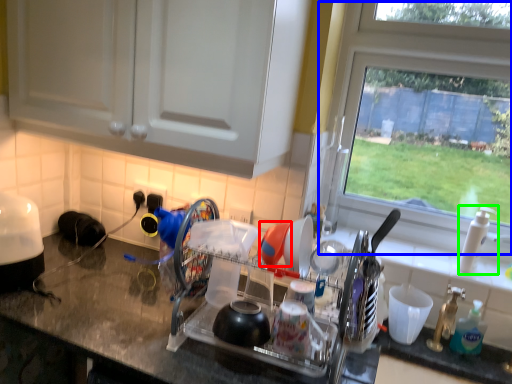
Question: Which object is the farthest from tableware (highlighted by a red box)? Choose among these: window (highlighted by a blue box) or faucet (highlighted by a green box).

Choices:
 (A) window
 (B) faucet

Answer: (A)